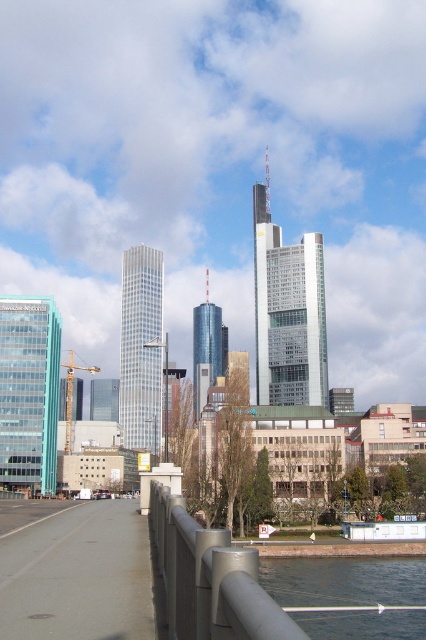
Is point (163, 492) farther from camera compared to point (304, 563)?

No, (163, 492) is closer to viewer.

The width and height of the screenshot is (426, 640). I want to click on metallic gray railing at lower center, so [x=210, y=579].